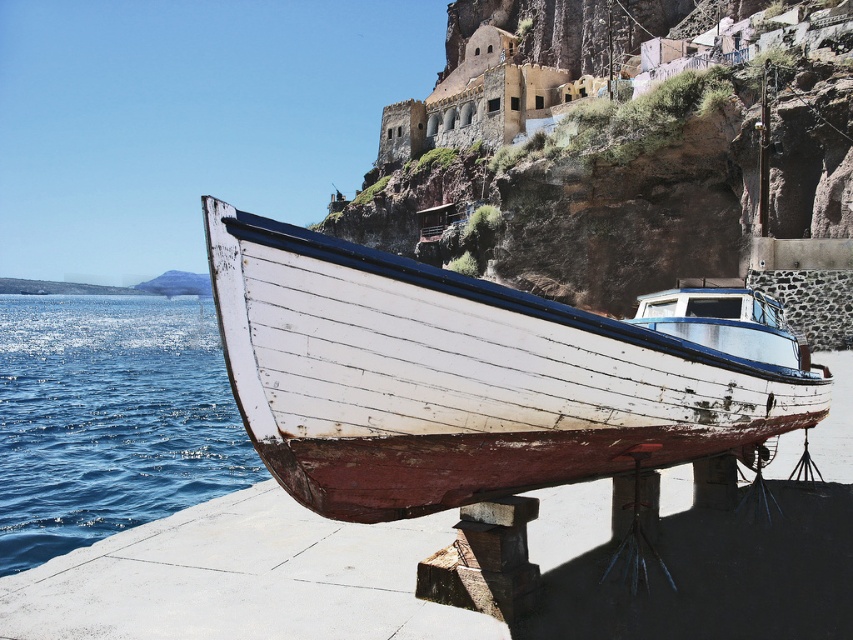
You are a marine biologist planning to launch a small research boat from the dock. The boat requires a minimum of 200 feet of open water to safely navigate. Based on the scene, is the distance between the white wooden boat at center and the blue water at lower left sufficient for your boat to maneuver safely?

The distance between the white wooden boat at center and the blue water at lower left is 250.16 feet, which exceeds the required 200 feet. Therefore, the blue water at lower left provides sufficient space for the research boat to maneuver safely.

You are standing on the dock and see the white wood water at lower left and the blue water at lower left. Which one is higher up from the ground?

The white wood water at lower left is taller than the blue water at lower left, so it is higher up from the ground.